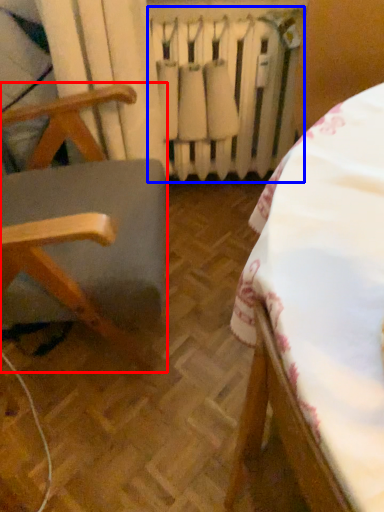
Question: Which point is further to the camera, furniture (highlighted by a red box) or radiator (highlighted by a blue box)?

Choices:
 (A) furniture
 (B) radiator

Answer: (B)